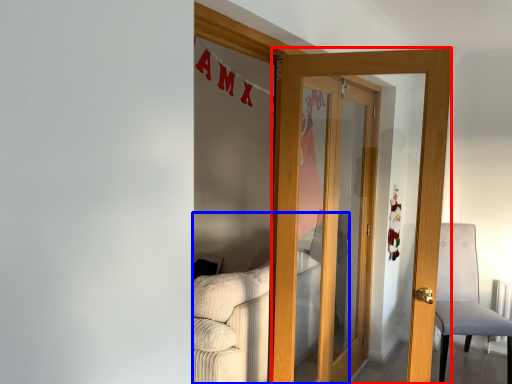
Question: Which point is further to the camera, door (highlighted by a red box) or couch (highlighted by a blue box)?

Choices:
 (A) door
 (B) couch

Answer: (B)